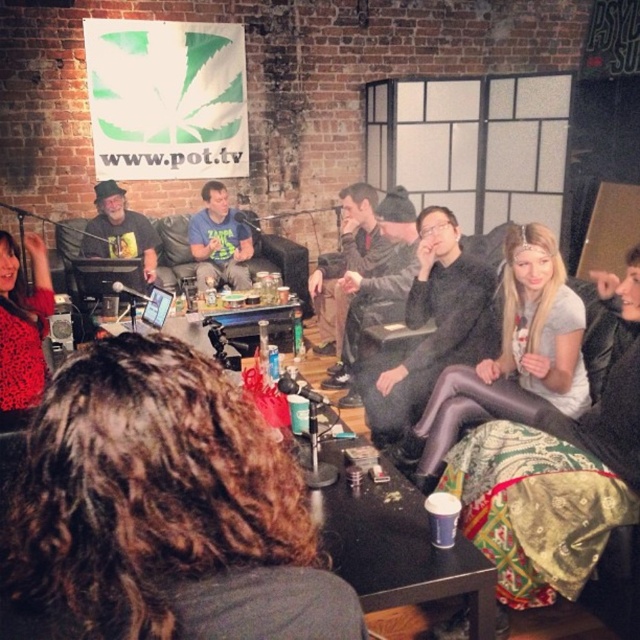
You are sitting at the point labeled point (147, 257) and want to reach the exit located at point (536, 564). Is the exit directly behind you or in front of you?

The exit at point 0.883, 0.830 is in front of you because point (536, 564) is in front of point (147, 257).